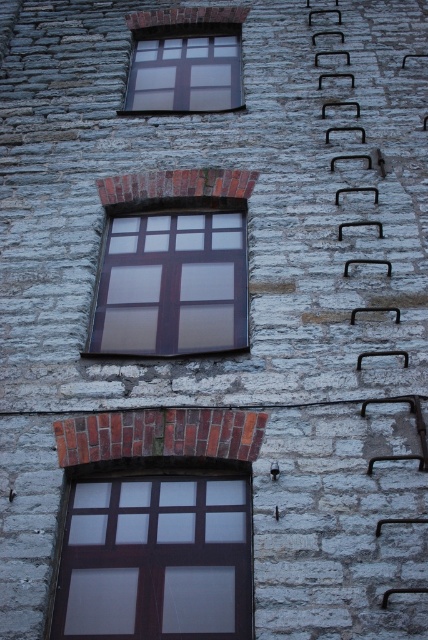
Question: Is matte brown window at center below matte glass window at upper center?

Choices:
 (A) no
 (B) yes

Answer: (B)

Question: Which of the following is the closest to the observer?

Choices:
 (A) (121, 580)
 (B) (140, 332)

Answer: (A)

Question: Based on their relative distances, which object is farther from the matte glass window at upper center?

Choices:
 (A) matte brown window at lower center
 (B) matte brown window at center

Answer: (A)

Question: Which object is farther from the camera taking this photo?

Choices:
 (A) matte brown window at center
 (B) matte glass window at upper center

Answer: (B)

Question: Can you confirm if matte brown window at lower center is thinner than matte brown window at center?

Choices:
 (A) no
 (B) yes

Answer: (B)

Question: Does matte brown window at lower center lie behind matte brown window at center?

Choices:
 (A) yes
 (B) no

Answer: (B)